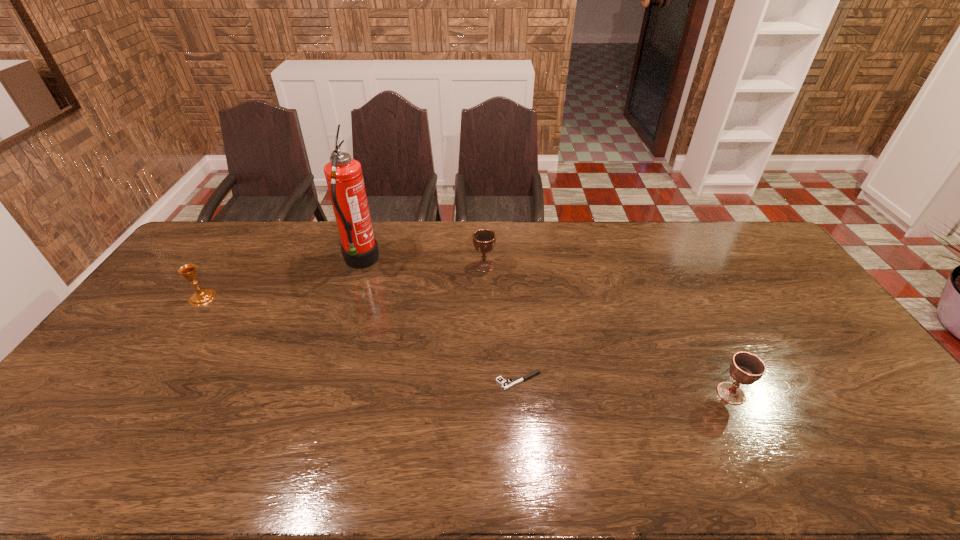
You are a GUI agent. You are given a task and a screenshot of the screen. Output one action in this format:
    pyautogui.click(x=<x>, y=<y>)
    Task: Click on the free space between the rightmost object and the fourth object from right to left
    
    Given the screenshot: What is the action you would take?
    pyautogui.click(x=546, y=328)

Locate an element on the screen. This screenshot has height=540, width=960. empty space that is in between the rightmost chalice and the tallest object is located at coordinates (546, 328).

Where is `object that can be found as the third closest to the third farthest object`? Image resolution: width=960 pixels, height=540 pixels. object that can be found as the third closest to the third farthest object is located at coordinates (504, 384).

Point out which object is positioned as the nearest to the pistol. Please provide its 2D coordinates. Your answer should be formatted as a tuple, i.e. [(x, y)], where the tuple contains the x and y coordinates of a point satisfying the conditions above.

[(484, 240)]

Identify which chalice is the nearest to the third nearest object. Please provide its 2D coordinates. Your answer should be formatted as a tuple, i.e. [(x, y)], where the tuple contains the x and y coordinates of a point satisfying the conditions above.

[(484, 240)]

Select which chalice appears as the closest to the leftmost object. Please provide its 2D coordinates. Your answer should be formatted as a tuple, i.e. [(x, y)], where the tuple contains the x and y coordinates of a point satisfying the conditions above.

[(484, 240)]

The height and width of the screenshot is (540, 960). I want to click on blank space that satisfies the following two spatial constraints: 1. on the front side of the farthest chalice; 2. on the left side of the rightmost chalice, so click(x=486, y=394).

At what (x,y) coordinates should I click in order to perform the action: click on free spot that satisfies the following two spatial constraints: 1. on the back side of the second nearest chalice; 2. on the left side of the farthest chalice. Please return your answer as a coordinate pair (x, y). This screenshot has width=960, height=540. Looking at the image, I should click on (225, 266).

Identify the location of vacant region that satisfies the following two spatial constraints: 1. on the front side of the second chalice from left to right; 2. on the left side of the rightmost object. (486, 394).

Locate an element on the screen. vacant space that satisfies the following two spatial constraints: 1. on the front-facing side of the fire extinguisher; 2. on the left side of the nearest chalice is located at coordinates (319, 394).